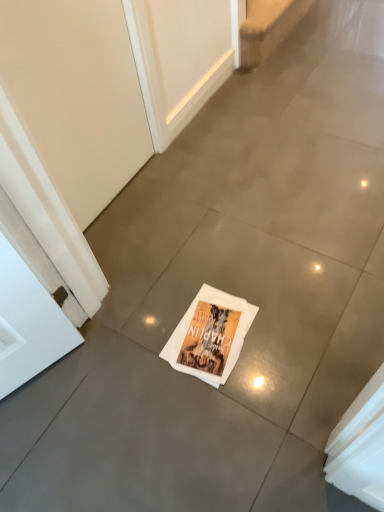
Question: Is beige carpet at upper center to the left or to the right of white paper magazine at center in the image?

Choices:
 (A) left
 (B) right

Answer: (B)

Question: From a real-world perspective, is beige carpet at upper center positioned above or below white paper magazine at center?

Choices:
 (A) above
 (B) below

Answer: (A)

Question: Which object is positioned closest to the beige matte screen door at upper left?

Choices:
 (A) beige carpet at upper center
 (B) white paper magazine at center

Answer: (B)

Question: Which is farther from the beige carpet at upper center?

Choices:
 (A) beige matte screen door at upper left
 (B) white paper magazine at center

Answer: (B)